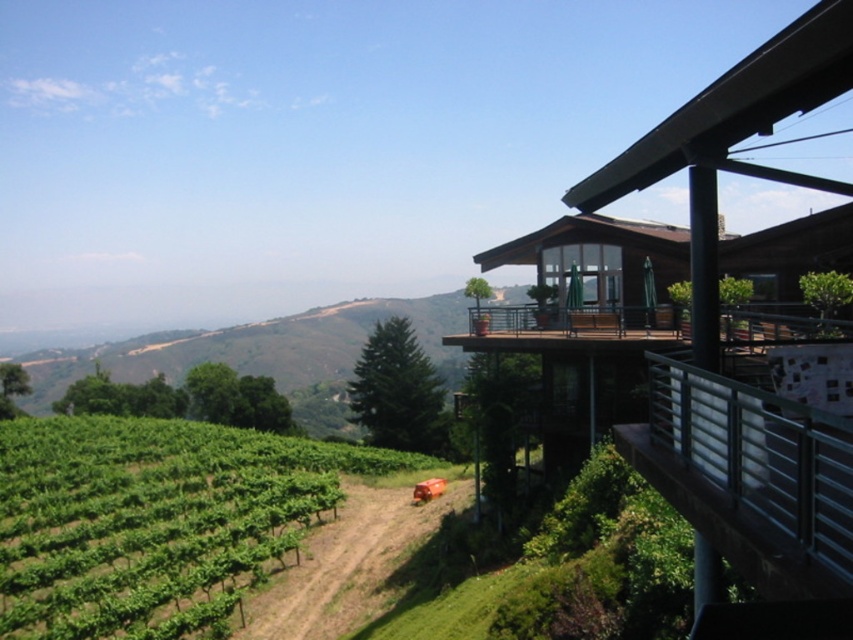
Question: Does metallic silver railing at upper right have a lesser width compared to wooden deck at upper right?

Choices:
 (A) no
 (B) yes

Answer: (B)

Question: From the image, what is the correct spatial relationship of metallic silver railing at upper right in relation to wooden deck at upper right?

Choices:
 (A) right
 (B) left

Answer: (B)

Question: Among these points, which one is farthest from the camera?

Choices:
 (A) (590, 310)
 (B) (113, 524)

Answer: (B)

Question: In this image, where is brown dirt track at lower center located relative to wooden deck at upper right?

Choices:
 (A) right
 (B) left

Answer: (B)

Question: Which object is the closest to the wooden deck at upper right?

Choices:
 (A) green leafy vineyard at lower left
 (B) metallic silver railing at upper right
 (C) brown dirt track at lower center

Answer: (B)

Question: Which point appears farthest from the camera in this image?

Choices:
 (A) (283, 573)
 (B) (221, 595)

Answer: (A)